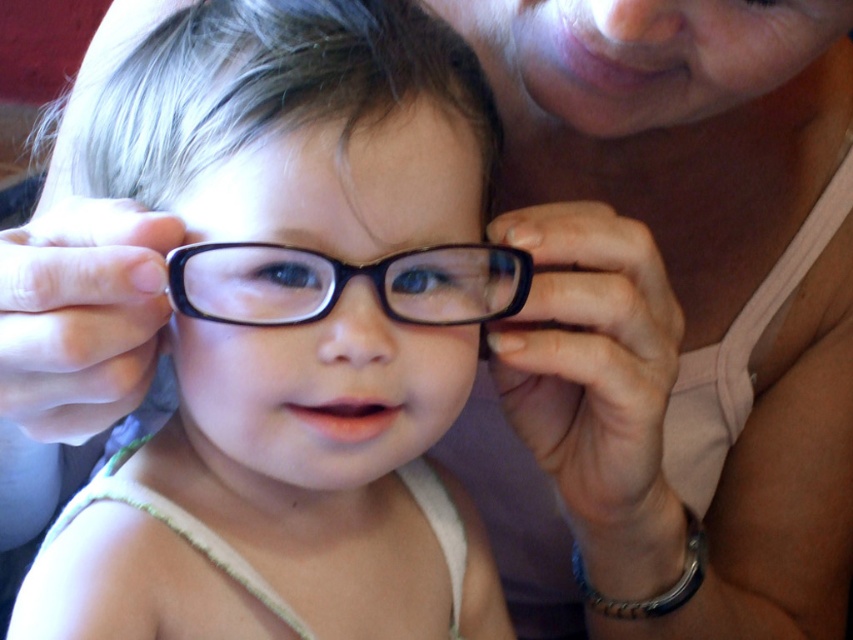
Question: Is matte black glasses at center to the right of black plastic glasses at center from the viewer's perspective?

Choices:
 (A) yes
 (B) no

Answer: (B)

Question: Considering the relative positions of matte black glasses at center and black plastic glasses at center in the image provided, where is matte black glasses at center located with respect to black plastic glasses at center?

Choices:
 (A) below
 (B) above

Answer: (A)

Question: Among these objects, which one is nearest to the camera?

Choices:
 (A) matte black glasses at center
 (B) black plastic glasses at center

Answer: (A)

Question: Can you confirm if matte black glasses at center is wider than black plastic glasses at center?

Choices:
 (A) yes
 (B) no

Answer: (A)